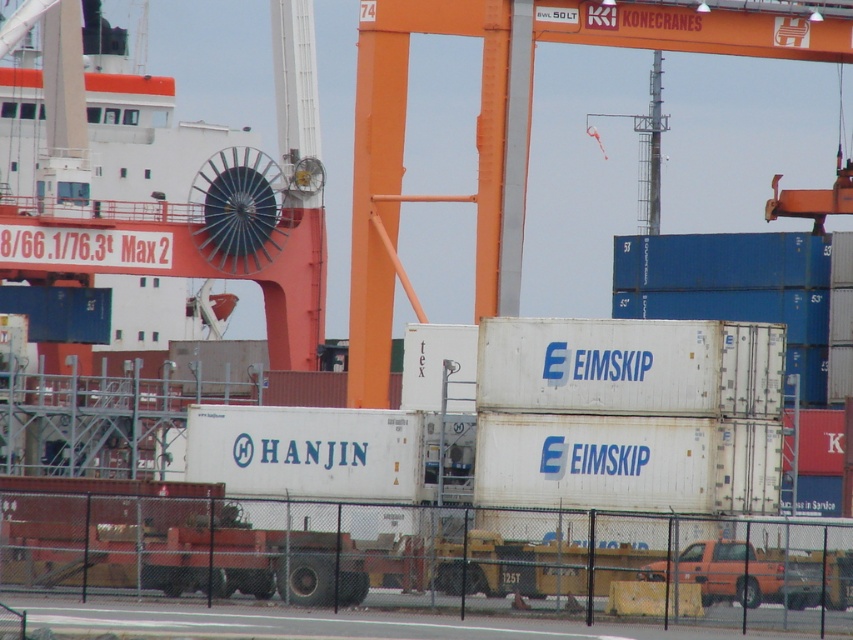
Question: Is orange metallic crane at center behind orange matte truck at lower right?

Choices:
 (A) no
 (B) yes

Answer: (B)

Question: Is orange metallic crane at center wider than orange matte truck at lower right?

Choices:
 (A) yes
 (B) no

Answer: (A)

Question: Which point is closer to the camera?

Choices:
 (A) (703, 602)
 (B) (506, 209)

Answer: (A)

Question: Is the position of orange metallic crane at center more distant than that of orange matte truck at lower right?

Choices:
 (A) no
 (B) yes

Answer: (B)